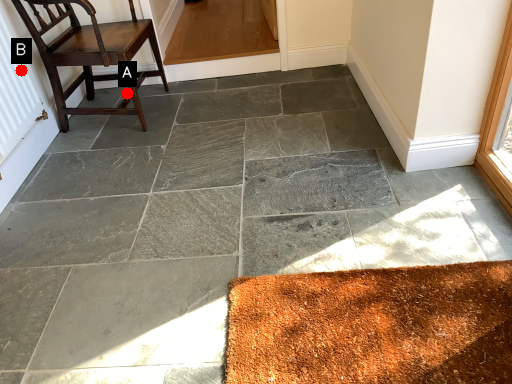
Question: Two points are circled on the image, labeled by A and B beside each circle. Which point appears farthest from the camera in this image?

Choices:
 (A) A is further
 (B) B is further

Answer: (A)